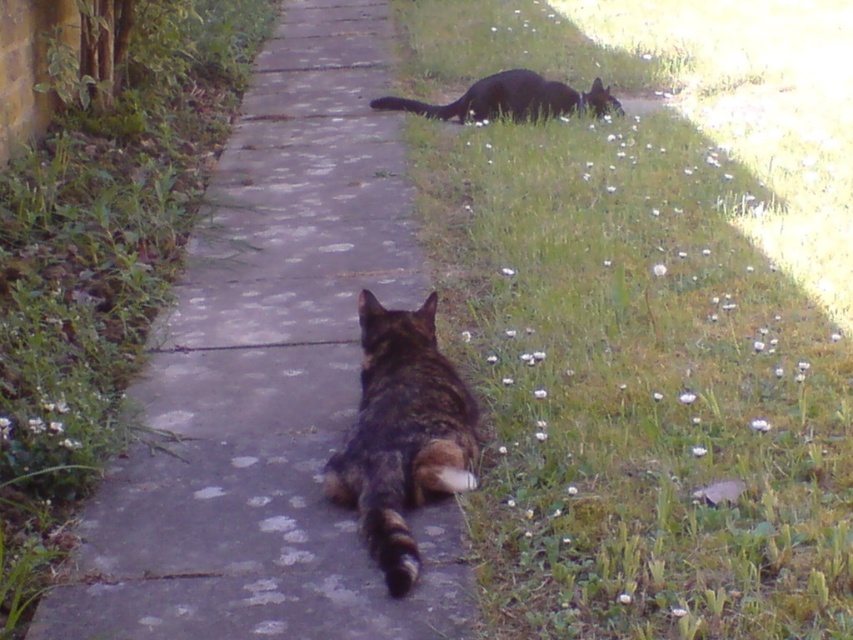
You are standing at the point marked by the coordinates point (270, 378), which is on the gray concrete pavement at center. You want to walk towards the grassy area on the right side of the pathway. Is the grassy area on the right side of the pathway located to your left or right side?

The grassy area on the right side of the pathway is located to your right side because you are standing on the gray concrete pavement at center, and the pathway is between the gray concrete pavement at center and the grassy area on the right side. Since you want to walk towards the grassy area on the right side of the pathway, it would be to your right side.